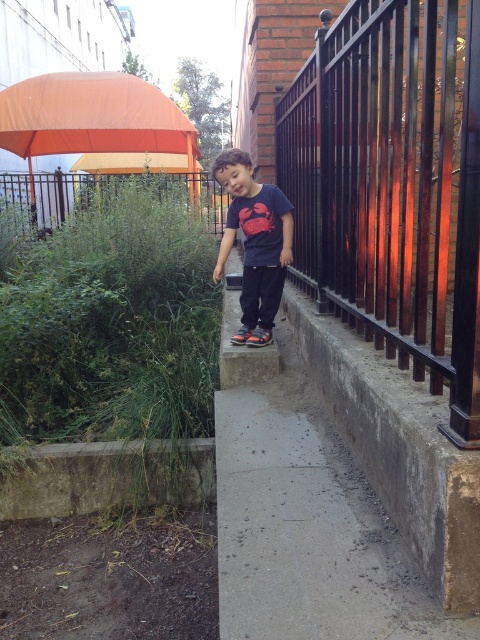
Between point (48, 131) and point (271, 243), which one is positioned in front?

Point (271, 243) is more forward.

Can you confirm if orange fabric umbrella at upper left is wider than dark blue t-shirt at center?

Indeed, orange fabric umbrella at upper left has a greater width compared to dark blue t-shirt at center.

Does point (16, 141) come in front of point (249, 243)?

No, (16, 141) is further to viewer.

Identify the location of orange fabric umbrella at upper left. (92, 116).

From the picture: Does black metal fence at right appear on the left side of orange fabric umbrella at upper left?

In fact, black metal fence at right is to the right of orange fabric umbrella at upper left.

Is point (288, 172) closer to camera compared to point (79, 132)?

Yes.

Is point (381, 147) positioned before point (131, 150)?

Yes, it is.

Find the location of a particular element. The width and height of the screenshot is (480, 640). black metal fence at right is located at coordinates (393, 186).

Is the position of black metal fence at right less distant than that of dark blue t-shirt at center?

Yes, it is in front of dark blue t-shirt at center.

Consider the image. Can you confirm if black metal fence at right is positioned above dark blue t-shirt at center?

Correct, black metal fence at right is located above dark blue t-shirt at center.

Find the location of a particular element. This screenshot has height=640, width=480. black metal fence at right is located at coordinates (393, 186).